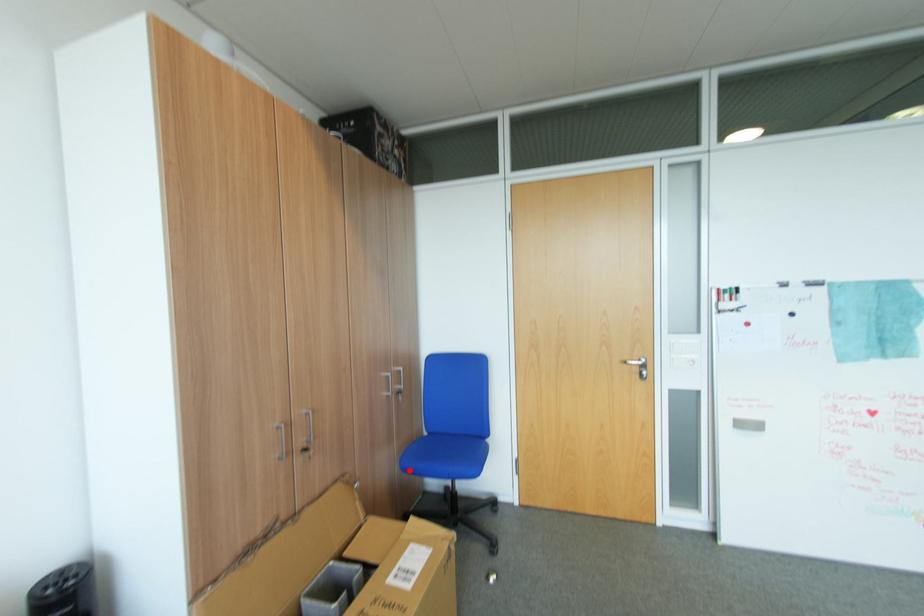
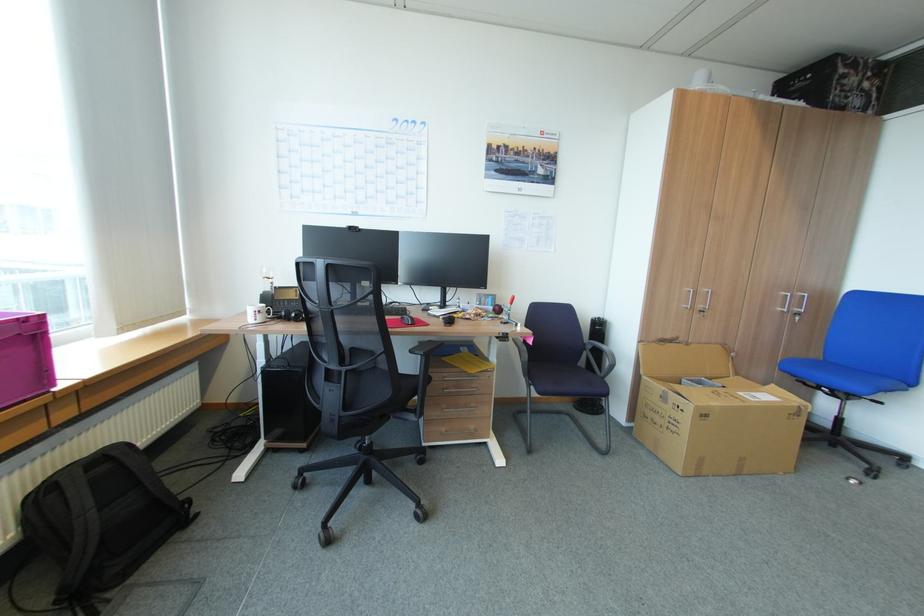
In the second image, find the point that corresponds to the highlighted location in the first image.

(786, 370)